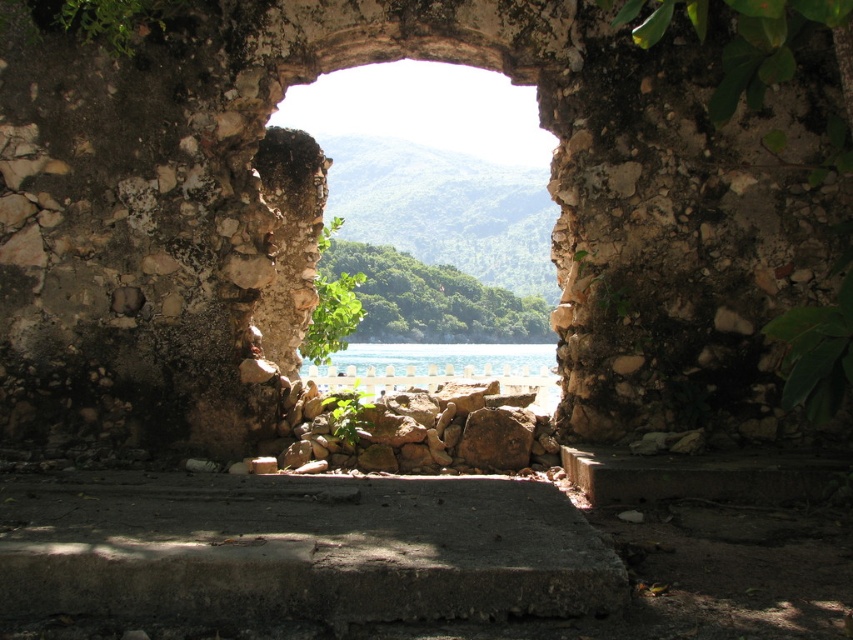
Question: Which of the following is the farthest from the observer?

Choices:
 (A) natural stone window at center
 (B) clear blue water at center

Answer: (B)

Question: Which object is closer to the camera taking this photo?

Choices:
 (A) clear blue water at center
 (B) natural stone window at center

Answer: (B)

Question: Is natural stone window at center below clear blue water at center?

Choices:
 (A) yes
 (B) no

Answer: (B)

Question: Which point appears farthest from the camera in this image?

Choices:
 (A) (538, 364)
 (B) (422, 122)

Answer: (B)

Question: Is natural stone window at center bigger than clear blue water at center?

Choices:
 (A) no
 (B) yes

Answer: (B)

Question: Is natural stone window at center bigger than clear blue water at center?

Choices:
 (A) yes
 (B) no

Answer: (A)